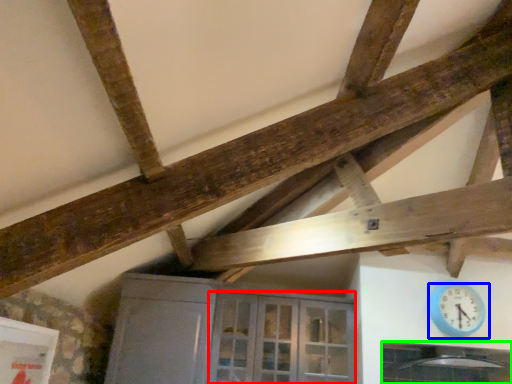
Question: Estimate the real-world distances between objects in this image. Which object is farther from glass door (highlighted by a red box), wall clock (highlighted by a blue box) or window (highlighted by a green box)?

Choices:
 (A) wall clock
 (B) window

Answer: (A)